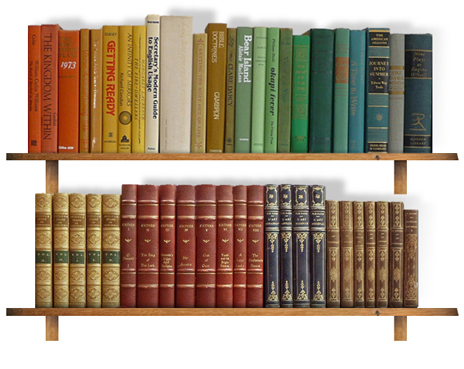
The height and width of the screenshot is (369, 464). Identify the location of blue books. (356, 87), (375, 85), (415, 82), (316, 228), (301, 229), (288, 229), (273, 229).